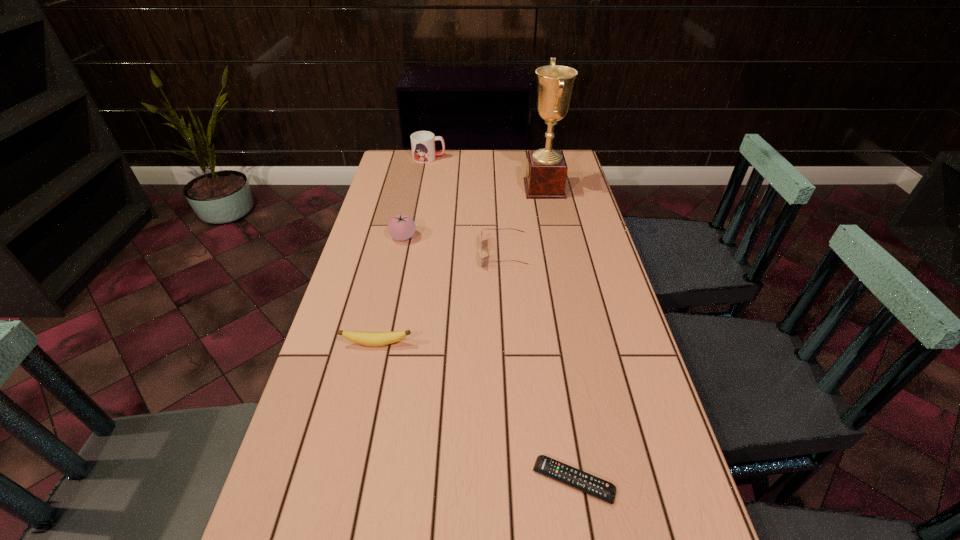
You are a GUI agent. You are given a task and a screenshot of the screen. Output one action in this format:
    pyautogui.click(x=<x>, y=<y>)
    Task: Click on the free space at the right edge of the desktop
    This screenshot has height=540, width=960.
    Given the screenshot: What is the action you would take?
    pyautogui.click(x=582, y=179)

The height and width of the screenshot is (540, 960). In the image, there is a desktop. What are the coordinates of `vacant region at the far right corner` in the screenshot? It's located at (571, 162).

You are a GUI agent. You are given a task and a screenshot of the screen. Output one action in this format:
    pyautogui.click(x=<x>, y=<y>)
    Task: Click on the free area in between the shortest object and the tallest object
    The image size is (960, 540).
    Given the screenshot: What is the action you would take?
    pyautogui.click(x=559, y=335)

The image size is (960, 540). In order to click on empty location between the shortest object and the second farthest object in this screenshot , I will do `click(559, 335)`.

Find the location of a particular element. This screenshot has width=960, height=540. free space between the sunglasses and the trophy cup is located at coordinates (524, 221).

The height and width of the screenshot is (540, 960). I want to click on vacant area that lies between the sunglasses and the third tallest object, so click(453, 246).

Where is `free spot between the tomato and the nearest object`? Image resolution: width=960 pixels, height=540 pixels. free spot between the tomato and the nearest object is located at coordinates (489, 359).

Identify the location of free point between the third tallest object and the remote control. Image resolution: width=960 pixels, height=540 pixels. (489, 359).

This screenshot has width=960, height=540. I want to click on unoccupied position between the tomato and the remote control, so click(x=489, y=359).

What are the coordinates of `vacant area that lies between the banana and the fourth shortest object` in the screenshot? It's located at (390, 291).